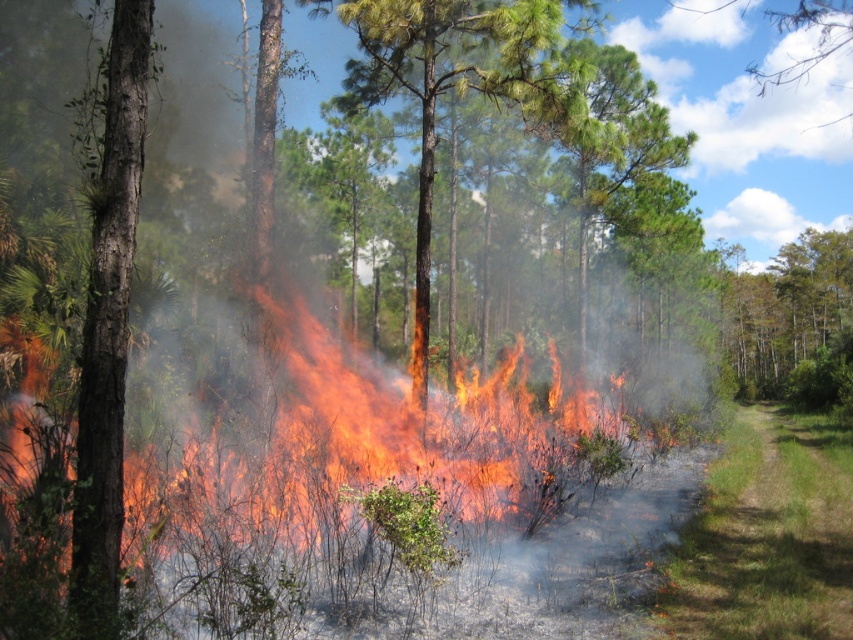
Question: From the image, what is the correct spatial relationship of smooth bark tree at left in relation to green matte tree at upper right?

Choices:
 (A) below
 (B) above

Answer: (A)

Question: Can you confirm if smooth bark tree at left is positioned below green matte tree at upper right?

Choices:
 (A) yes
 (B) no

Answer: (A)

Question: Which point is closer to the camera taking this photo?

Choices:
 (A) (97, 548)
 (B) (721, 308)

Answer: (A)

Question: Observing the image, what is the correct spatial positioning of smooth bark tree at left in reference to green matte tree at upper right?

Choices:
 (A) right
 (B) left

Answer: (B)